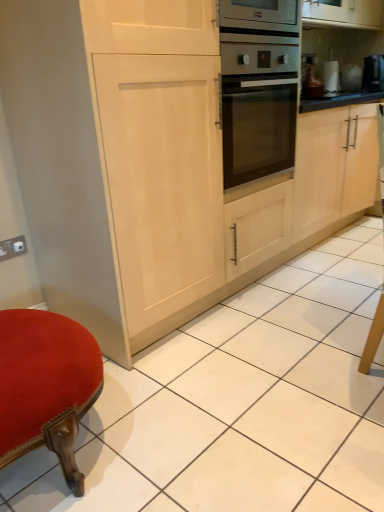
Locate an element on the screen. This screenshot has height=512, width=384. black glossy coffee maker at upper right is located at coordinates (373, 73).

What do you see at coordinates (373, 73) in the screenshot? This screenshot has height=512, width=384. I see `black glossy coffee maker at upper right` at bounding box center [373, 73].

What do you see at coordinates (13, 247) in the screenshot? The width and height of the screenshot is (384, 512). I see `matte white electric outlet at lower left` at bounding box center [13, 247].

Find the location of a particular element. matte white electric outlet at lower left is located at coordinates (13, 247).

Identify the location of black glossy coffee maker at upper right. (373, 73).

Considering the relative positions of matte white electric outlet at lower left and black glossy coffee maker at upper right in the image provided, is matte white electric outlet at lower left to the right of black glossy coffee maker at upper right from the viewer's perspective?

In fact, matte white electric outlet at lower left is to the left of black glossy coffee maker at upper right.

Considering their positions, is matte white electric outlet at lower left located in front of or behind black glossy coffee maker at upper right?

Visually, matte white electric outlet at lower left is located in front of black glossy coffee maker at upper right.

Is point (9, 254) farther from camera compared to point (373, 56)?

No, (9, 254) is in front of (373, 56).

From the image's perspective, between matte white electric outlet at lower left and black glossy coffee maker at upper right, which one is located above?

From the image's view, black glossy coffee maker at upper right is above.

From a real-world perspective, is matte white electric outlet at lower left located higher than black glossy coffee maker at upper right?

No, from a real-world perspective, matte white electric outlet at lower left is not over black glossy coffee maker at upper right

Which of these two, matte white electric outlet at lower left or black glossy coffee maker at upper right, is thinner?

matte white electric outlet at lower left is thinner.

Is matte white electric outlet at lower left shorter than black glossy coffee maker at upper right?

Indeed, matte white electric outlet at lower left has a lesser height compared to black glossy coffee maker at upper right.

Does matte white electric outlet at lower left have a smaller size compared to black glossy coffee maker at upper right?

Yes.

Do you think matte white electric outlet at lower left is within black glossy coffee maker at upper right, or outside of it?

matte white electric outlet at lower left is not enclosed by black glossy coffee maker at upper right.

Is matte white electric outlet at lower left far away from black glossy coffee maker at upper right?

Absolutely, matte white electric outlet at lower left is distant from black glossy coffee maker at upper right.

Is matte white electric outlet at lower left looking in the opposite direction of black glossy coffee maker at upper right?

No.

In order to click on electric outlet in front of the black glossy coffee maker at upper right in this screenshot , I will do `click(13, 247)`.

Between black glossy coffee maker at upper right and matte white electric outlet at lower left, which one appears on the right side from the viewer's perspective?

black glossy coffee maker at upper right is more to the right.

Consider the image. Between black glossy coffee maker at upper right and matte white electric outlet at lower left, which one is positioned behind?

black glossy coffee maker at upper right is more distant.

Which point is more forward, (382, 64) or (15, 242)?

The point (15, 242) is closer.

From the image's perspective, is black glossy coffee maker at upper right positioned above or below matte white electric outlet at lower left?

From the image's perspective, black glossy coffee maker at upper right appears above matte white electric outlet at lower left.

From a real-world perspective, which is physically below, black glossy coffee maker at upper right or matte white electric outlet at lower left?

In real-world perspective, matte white electric outlet at lower left is lower.

Which object is thinner, black glossy coffee maker at upper right or matte white electric outlet at lower left?

Thinner between the two is matte white electric outlet at lower left.

Who is shorter, black glossy coffee maker at upper right or matte white electric outlet at lower left?

matte white electric outlet at lower left is shorter.

Looking at this image, between black glossy coffee maker at upper right and matte white electric outlet at lower left, which one has larger size?

black glossy coffee maker at upper right.

Is black glossy coffee maker at upper right spatially inside matte white electric outlet at lower left, or outside of it?

black glossy coffee maker at upper right exists outside the volume of matte white electric outlet at lower left.

In the scene shown: Are black glossy coffee maker at upper right and matte white electric outlet at lower left making contact?

No, black glossy coffee maker at upper right is not with matte white electric outlet at lower left.

Is black glossy coffee maker at upper right facing away from matte white electric outlet at lower left?

No, matte white electric outlet at lower left is not at the back of black glossy coffee maker at upper right.

How many degrees apart are the facing directions of black glossy coffee maker at upper right and matte white electric outlet at lower left?

They differ by 5.03 degrees in their facing directions.

The height and width of the screenshot is (512, 384). What are the coordinates of `appliance above the matte white electric outlet at lower left (from a real-world perspective)` in the screenshot? It's located at (373, 73).

This screenshot has height=512, width=384. Identify the location of electric outlet to the left of black glossy coffee maker at upper right. (13, 247).

This screenshot has height=512, width=384. I want to click on appliance that appears on the right of matte white electric outlet at lower left, so click(373, 73).